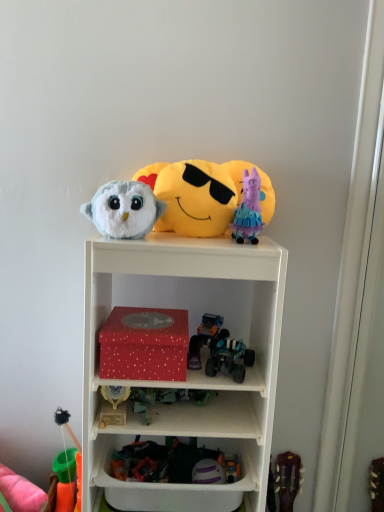
The image size is (384, 512). What do you see at coordinates (220, 350) in the screenshot? I see `teal plastic toy car at center, which is the fifth toy in top-to-bottom order` at bounding box center [220, 350].

I want to click on teal plastic toy car at center, placed as the 5th toy when sorted from bottom to top, so click(220, 350).

At what (x,y) coordinates should I click in order to perform the action: click on yellow plush at upper center, the 2th toy viewed from the top. Please return your answer as a coordinate pair (x, y). The height and width of the screenshot is (512, 384). Looking at the image, I should click on (203, 195).

What do you see at coordinates (19, 493) in the screenshot?
I see `orange fabric toy at lower left, the 1th toy in the bottom-to-top sequence` at bounding box center [19, 493].

In order to click on fluffy white owl at upper center, arranged as the 3th toy when viewed from the top in this screenshot , I will do `click(124, 209)`.

In terms of size, does shiny metallic truck at center, the sixth toy from the bottom, appear bigger or smaller than orange fabric toy at lower left, the 9th toy in the top-to-bottom sequence?

Clearly, shiny metallic truck at center, the sixth toy from the bottom, is smaller in size than orange fabric toy at lower left, the 9th toy in the top-to-bottom sequence.

Identify the location of the 5th toy positioned above the orange fabric toy at lower left, the 9th toy in the top-to-bottom sequence (from a real-world perspective). This screenshot has width=384, height=512. (205, 338).

Is orange fabric toy at lower left, the 9th toy in the top-to-bottom sequence, surrounded by shiny metallic truck at center, arranged as the fourth toy when viewed from the top?

Definitely not — orange fabric toy at lower left, the 9th toy in the top-to-bottom sequence, is not inside shiny metallic truck at center, arranged as the fourth toy when viewed from the top.

Between shiny metallic truck at center, arranged as the fourth toy when viewed from the top, and orange fabric toy at lower left, the 1th toy in the bottom-to-top sequence, which one appears on the right side from the viewer's perspective?

shiny metallic truck at center, arranged as the fourth toy when viewed from the top.

Which is less distant, (207,464) or (55,412)?

Point (207,464) is positioned closer to the camera compared to point (55,412).

Is purple matte helmet at lower center, the second toy ordered from the bottom, shorter than soft plush toy at lower left, the 7th toy viewed from the top?

Indeed, purple matte helmet at lower center, the second toy ordered from the bottom, has a lesser height compared to soft plush toy at lower left, the 7th toy viewed from the top.

From a real-world perspective, is purple matte helmet at lower center, the 8th toy viewed from the top, under soft plush toy at lower left, the 7th toy viewed from the top?

No, from a real-world perspective, purple matte helmet at lower center, the 8th toy viewed from the top, is not below soft plush toy at lower left, the 7th toy viewed from the top.

Which is in front, point (65, 417) or point (216, 394)?

The point (216, 394) is closer.

Looking at this image, is soft plush toy at lower left, which is the 3th toy from bottom to top, taller or shorter than metallic green toy car at center, the sixth toy when ordered from top to bottom?

Clearly, soft plush toy at lower left, which is the 3th toy from bottom to top, is taller compared to metallic green toy car at center, the sixth toy when ordered from top to bottom.

Considering the relative sizes of soft plush toy at lower left, which is the 3th toy from bottom to top, and metallic green toy car at center, the sixth toy when ordered from top to bottom, in the image provided, is soft plush toy at lower left, which is the 3th toy from bottom to top, wider than metallic green toy car at center, the sixth toy when ordered from top to bottom,?

Incorrect, the width of soft plush toy at lower left, which is the 3th toy from bottom to top, does not surpass that of metallic green toy car at center, the sixth toy when ordered from top to bottom.

Considering the sizes of soft plush toy at lower left, the 7th toy viewed from the top, and metallic green toy car at center, the sixth toy when ordered from top to bottom, in the image, is soft plush toy at lower left, the 7th toy viewed from the top, bigger or smaller than metallic green toy car at center, the sixth toy when ordered from top to bottom,?

Considering their sizes, soft plush toy at lower left, the 7th toy viewed from the top, takes up more space than metallic green toy car at center, the sixth toy when ordered from top to bottom.

Could you tell me if yellow plush at upper center, the eighth toy positioned from the bottom, is turned towards orange fabric toy at lower left, the 9th toy in the top-to-bottom sequence?

No, yellow plush at upper center, the eighth toy positioned from the bottom, is not oriented towards orange fabric toy at lower left, the 9th toy in the top-to-bottom sequence.

From a real-world perspective, is yellow plush at upper center, the 2th toy viewed from the top, physically located above or below orange fabric toy at lower left, the 9th toy in the top-to-bottom sequence?

In terms of real-world spatial position, yellow plush at upper center, the 2th toy viewed from the top, is above orange fabric toy at lower left, the 9th toy in the top-to-bottom sequence.

Is yellow plush at upper center, the 2th toy viewed from the top, bigger or smaller than orange fabric toy at lower left, the 9th toy in the top-to-bottom sequence?

Considering their sizes, yellow plush at upper center, the 2th toy viewed from the top, takes up more space than orange fabric toy at lower left, the 9th toy in the top-to-bottom sequence.

Between yellow plush at upper center, the 2th toy viewed from the top, and orange fabric toy at lower left, the 9th toy in the top-to-bottom sequence, which one appears on the left side from the viewer's perspective?

Positioned to the left is orange fabric toy at lower left, the 9th toy in the top-to-bottom sequence.

From a real-world perspective, which is physically above, purple matte helmet at lower center, the second toy ordered from the bottom, or fluffy white owl at upper center, the 7th toy ordered from the bottom?

fluffy white owl at upper center, the 7th toy ordered from the bottom.

Can you see purple matte helmet at lower center, the second toy ordered from the bottom, touching fluffy white owl at upper center, the 7th toy ordered from the bottom?

No, purple matte helmet at lower center, the second toy ordered from the bottom, is not making contact with fluffy white owl at upper center, the 7th toy ordered from the bottom.

Is purple matte helmet at lower center, the second toy ordered from the bottom, facing towards fluffy white owl at upper center, the 7th toy ordered from the bottom?

No, purple matte helmet at lower center, the second toy ordered from the bottom, is not facing towards fluffy white owl at upper center, the 7th toy ordered from the bottom.

How different are the orientations of purple matte helmet at lower center, the second toy ordered from the bottom, and fluffy white owl at upper center, the 7th toy ordered from the bottom, in degrees?

6.94 degrees.

Does red matte box at center have a greater height compared to yellow plush at upper center, the 2th toy viewed from the top?

No.

Consider the image. Who is smaller, red matte box at center or yellow plush at upper center, the eighth toy positioned from the bottom?

Smaller between the two is red matte box at center.

How many degrees apart are the facing directions of red matte box at center and yellow plush at upper center, the eighth toy positioned from the bottom?

There is a 0.243-degree angle between the facing directions of red matte box at center and yellow plush at upper center, the eighth toy positioned from the bottom.

Consider the image. From the image's perspective, which one is positioned higher, red matte box at center or yellow plush at upper center, the 2th toy viewed from the top?

yellow plush at upper center, the 2th toy viewed from the top.

Based on the photo, is teal plastic toy car at center, placed as the 5th toy when sorted from bottom to top, bigger than fluffy white owl at upper center, arranged as the 3th toy when viewed from the top?

Incorrect, teal plastic toy car at center, placed as the 5th toy when sorted from bottom to top, is not larger than fluffy white owl at upper center, arranged as the 3th toy when viewed from the top.

What's the angular difference between teal plastic toy car at center, placed as the 5th toy when sorted from bottom to top, and fluffy white owl at upper center, arranged as the 3th toy when viewed from the top,'s facing directions?

4.59 degrees.

Measure the distance from teal plastic toy car at center, placed as the 5th toy when sorted from bottom to top, to fluffy white owl at upper center, the 7th toy ordered from the bottom.

teal plastic toy car at center, placed as the 5th toy when sorted from bottom to top, is 16.40 inches away from fluffy white owl at upper center, the 7th toy ordered from the bottom.

From the image's perspective, which toy is the 2nd one above the teal plastic toy car at center, placed as the 5th toy when sorted from bottom to top? Please provide its 2D coordinates.

[(124, 209)]

Identify the location of the 1st toy in front of the shiny metallic truck at center, the sixth toy from the bottom, starting your count from the anchor. (19, 493).

The height and width of the screenshot is (512, 384). I want to click on the 1st toy below the purple matte helmet at lower center, the second toy ordered from the bottom (from a real-world perspective), so click(67, 426).

Which object lies nearer to the anchor point purple matte helmet at lower center, the second toy ordered from the bottom, metallic green toy car at center, the sixth toy when ordered from top to bottom, or yellow plush at upper center, the eighth toy positioned from the bottom?

metallic green toy car at center, the sixth toy when ordered from top to bottom.

Estimate the real-world distances between objects in this image. Which object is closer to metallic green toy car at center, the sixth toy when ordered from top to bottom, shiny metallic truck at center, the sixth toy from the bottom, or teal plastic toy car at center, which is the fifth toy in top-to-bottom order?

shiny metallic truck at center, the sixth toy from the bottom.

When comparing their distances from fluffy white owl at upper center, the 7th toy ordered from the bottom, does soft plush toy at lower left, which is the 3th toy from bottom to top, or matte red box at center seem closer?

matte red box at center lies closer to fluffy white owl at upper center, the 7th toy ordered from the bottom, than the other object.

Considering their positions, is orange fabric toy at lower left, the 9th toy in the top-to-bottom sequence, positioned further to yellow plush at upper center, the eighth toy positioned from the bottom, than metallic green toy car at center, acting as the 4th toy starting from the bottom?

orange fabric toy at lower left, the 9th toy in the top-to-bottom sequence.

Based on their spatial positions, is yellow plush at upper center, the 2th toy viewed from the top, or matte red box at center closer to purple fabric pig at upper center, which is counted as the 9th toy, starting from the bottom?

yellow plush at upper center, the 2th toy viewed from the top.

Looking at the image, which one is located further to yellow plush at upper center, the eighth toy positioned from the bottom, fluffy white owl at upper center, arranged as the 3th toy when viewed from the top, or orange fabric toy at lower left, the 1th toy in the bottom-to-top sequence?

Among the two, orange fabric toy at lower left, the 1th toy in the bottom-to-top sequence, is located further to yellow plush at upper center, the eighth toy positioned from the bottom.

Based on their spatial positions, is metallic green toy car at center, acting as the 4th toy starting from the bottom, or orange fabric toy at lower left, the 1th toy in the bottom-to-top sequence, further from purple matte helmet at lower center, the 8th toy viewed from the top?

Based on the image, orange fabric toy at lower left, the 1th toy in the bottom-to-top sequence, appears to be further to purple matte helmet at lower center, the 8th toy viewed from the top.

Which object lies further to the anchor point metallic green toy car at center, the sixth toy when ordered from top to bottom, red matte box at center or orange fabric toy at lower left, the 9th toy in the top-to-bottom sequence?

Among the two, orange fabric toy at lower left, the 9th toy in the top-to-bottom sequence, is located further to metallic green toy car at center, the sixth toy when ordered from top to bottom.

The width and height of the screenshot is (384, 512). Identify the location of shelf between fluffy white owl at upper center, arranged as the 3th toy when viewed from the top, and orange fabric toy at lower left, the 9th toy in the top-to-bottom sequence, in the up-down direction. (189, 371).

The height and width of the screenshot is (512, 384). I want to click on box between purple fabric pig at upper center, which is counted as the 9th toy, starting from the bottom, and matte red box at center, in the vertical direction, so click(144, 344).

Locate an element on the screen. This screenshot has width=384, height=512. box between yellow plush at upper center, the eighth toy positioned from the bottom, and soft plush toy at lower left, the 7th toy viewed from the top, vertically is located at coordinates (144, 344).

Locate an element on the screen. This screenshot has height=512, width=384. toy between fluffy white owl at upper center, the 7th toy ordered from the bottom, and teal plastic toy car at center, which is the fifth toy in top-to-bottom order, in the vertical direction is located at coordinates (205, 338).